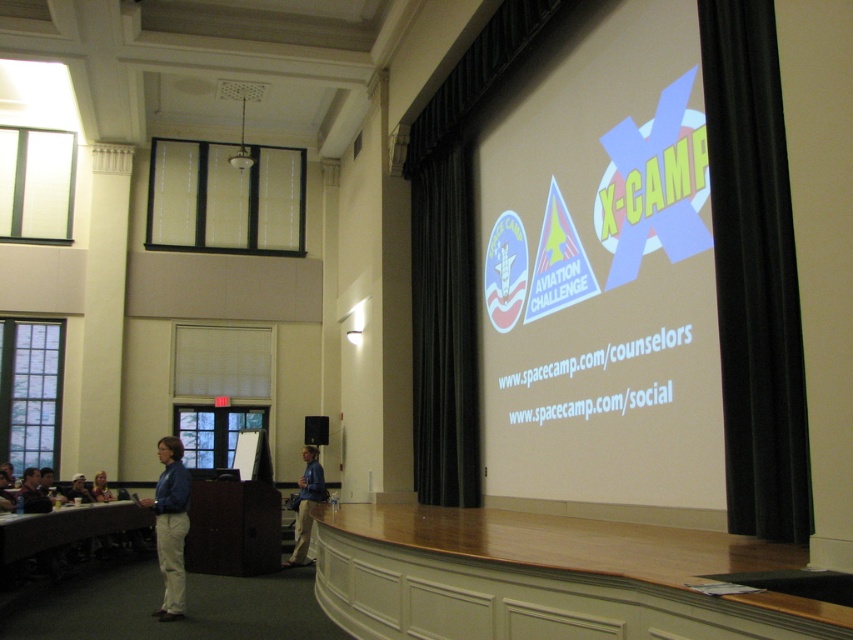
You are an event planner setting up a presentation. You need to ensure that the white matte projection screen at upper right and the light blue shirt at lower left are visible to the audience. Based on their sizes, which object should you prioritize placing closer to the front for better visibility?

The light blue shirt at lower left should be prioritized closer to the front because it is smaller in size than the white matte projection screen at upper right, ensuring it remains visible to the audience.

You are an attendee at the presentation. You notice the blue shirt at center and the light brown wooden table at lower left. Which object is positioned lower in the image?

The blue shirt at center is below light brown wooden table at lower left, so the blue shirt at center is positioned lower in the image.

Looking at this image, you are organizing a presentation and need to place a 10 cm thick binder on the blue shirt at center or the light brown wooden table at lower left. Based on their thickness, which object can safely hold the binder without it falling over?

The light brown wooden table at lower left can safely hold the 10 cm thick binder because it is thicker than the blue shirt at center, providing a more stable surface.